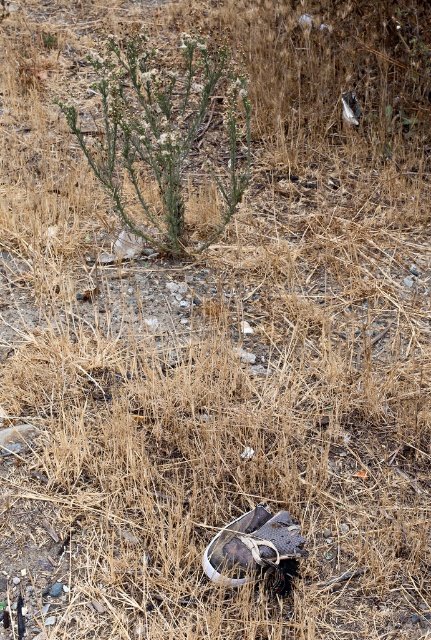
Question: Which point is closer to the camera taking this photo?

Choices:
 (A) (302, 552)
 (B) (162, 220)

Answer: (A)

Question: Among these points, which one is nearest to the camera?

Choices:
 (A) (252, 561)
 (B) (144, 100)

Answer: (A)

Question: Is green leafy plant at center bigger than white leather shoe at center?

Choices:
 (A) no
 (B) yes

Answer: (B)

Question: Does green leafy plant at center appear over white leather shoe at center?

Choices:
 (A) no
 (B) yes

Answer: (B)

Question: Is green leafy plant at center to the left of white leather shoe at center from the viewer's perspective?

Choices:
 (A) yes
 (B) no

Answer: (A)

Question: Among these objects, which one is farthest from the camera?

Choices:
 (A) white leather shoe at center
 (B) green leafy plant at center

Answer: (B)